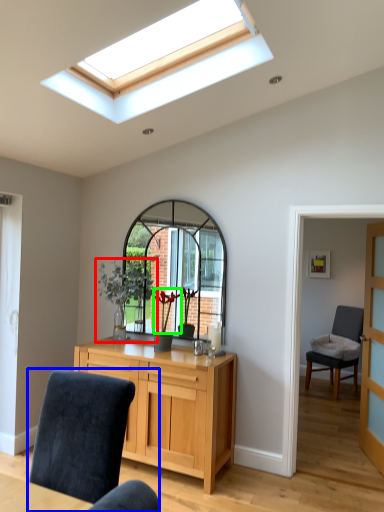
Question: Which object is positioned closest to houseplant (highlighted by a red box)? Select from chair (highlighted by a blue box) and flower (highlighted by a green box).

Choices:
 (A) chair
 (B) flower

Answer: (B)